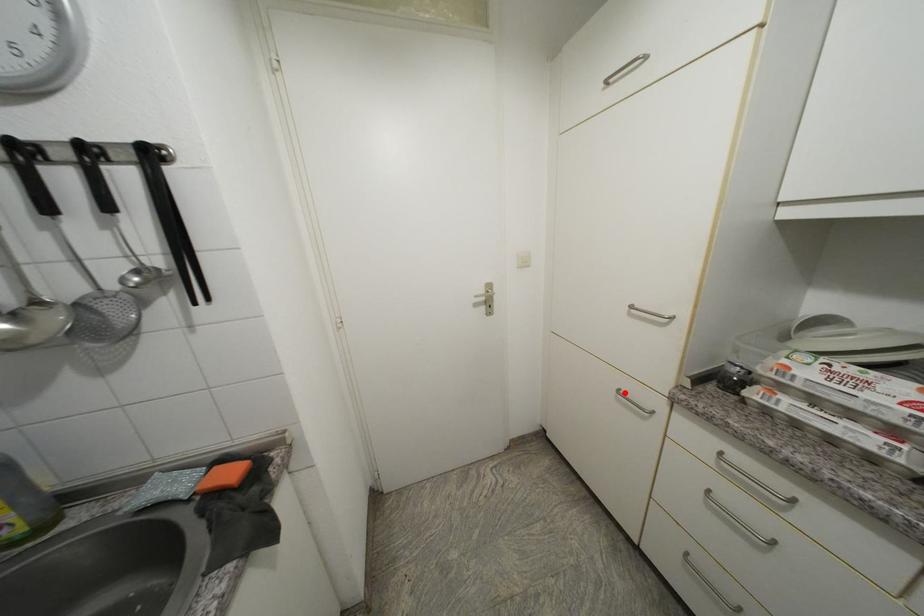
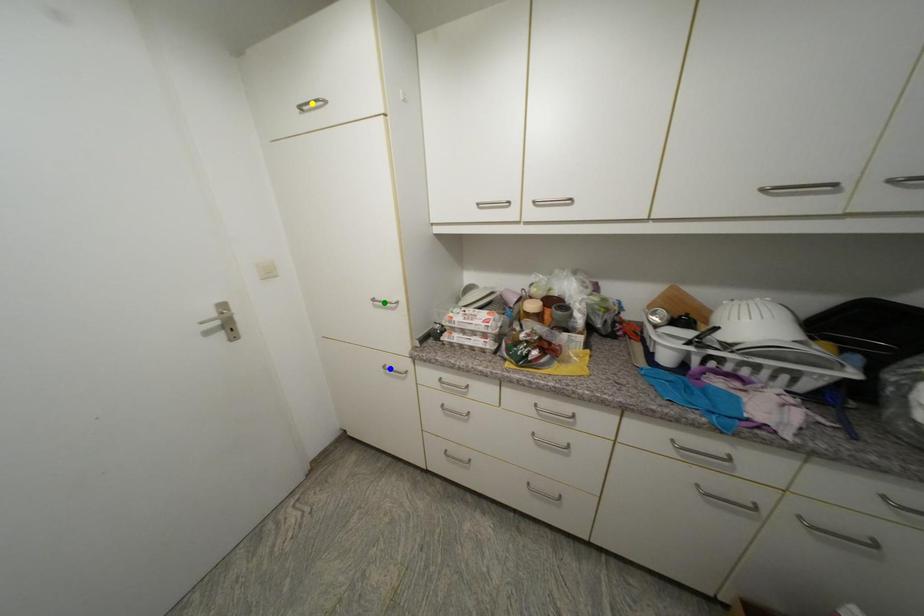
Question: I am providing you with two images of the same scene from different viewpoints. A red point is marked on the first image. You are given multiple points on the second image. In image 2, which mark is for the same physical point as the one in image 1?

Choices:
 (A) blue point
 (B) yellow point
 (C) green point

Answer: (A)